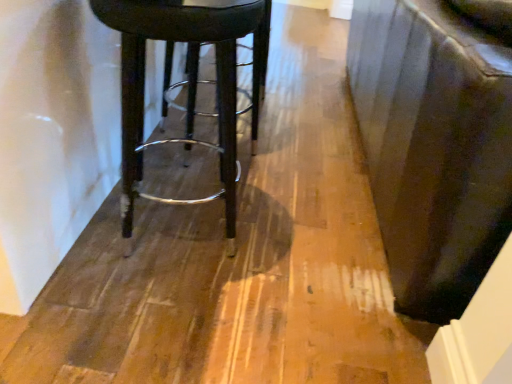
At what (x,y) coordinates should I click in order to perform the action: click on free space to the back side of matte black stool at center. Please return your answer as a coordinate pair (x, y). Looking at the image, I should click on (216, 168).